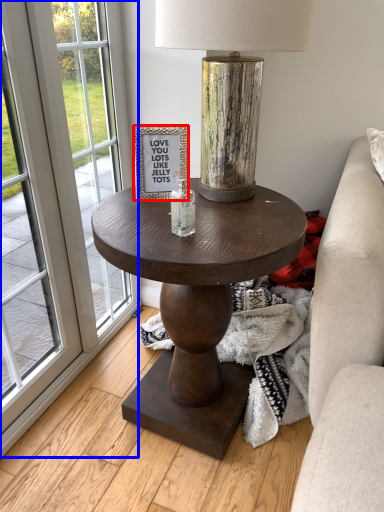
Question: Which object is closer to the camera taking this photo, picture frame (highlighted by a red box) or screen door (highlighted by a blue box)?

Choices:
 (A) picture frame
 (B) screen door

Answer: (B)